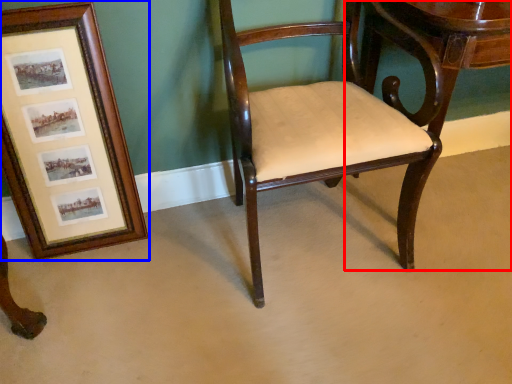
Question: Which of the following is the closest to the observer, table (highlighted by a red box) or picture frame (highlighted by a blue box)?

Choices:
 (A) table
 (B) picture frame

Answer: (B)